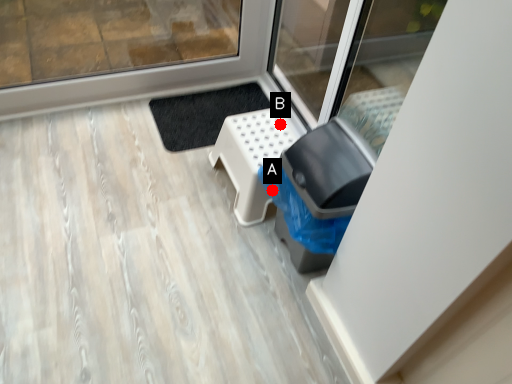
Question: Two points are circled on the image, labeled by A and B beside each circle. Which point is closer to the camera?

Choices:
 (A) A is closer
 (B) B is closer

Answer: (A)